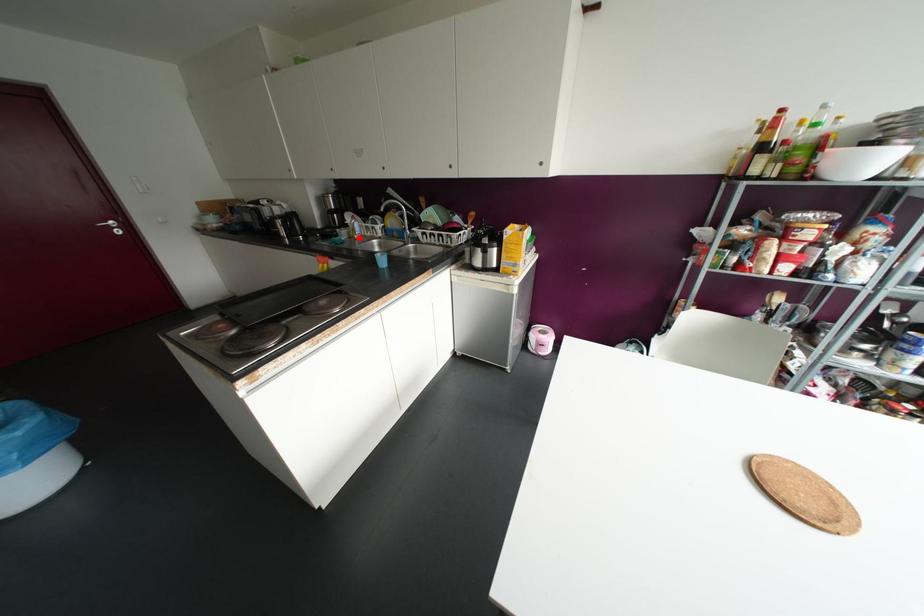
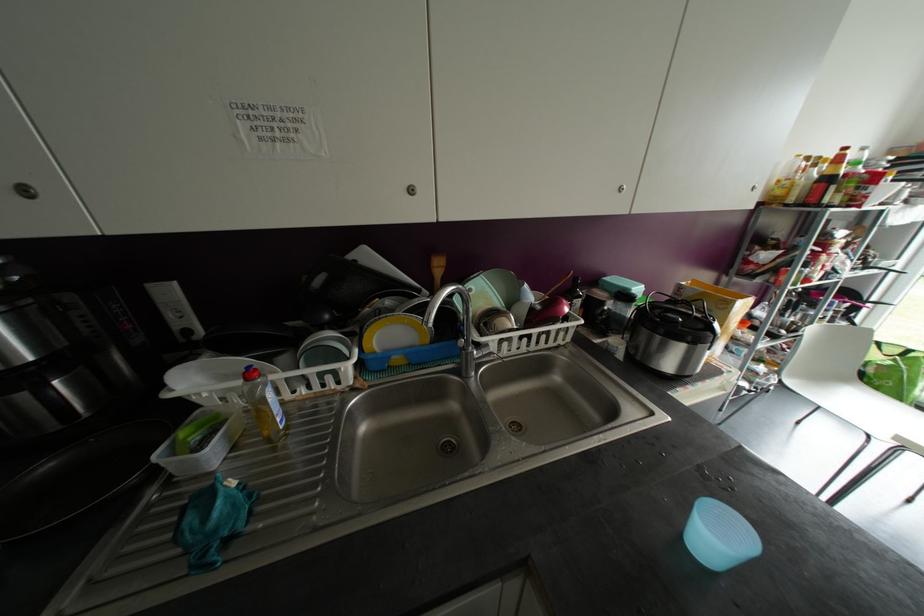
The point at the highlighted location is marked in the first image. Where is the corresponding point in the second image?

(286, 427)